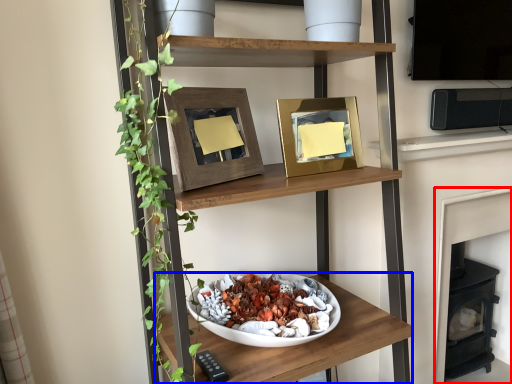
Question: Which point is further to the camera, fireplace (highlighted by a red box) or shelf (highlighted by a blue box)?

Choices:
 (A) fireplace
 (B) shelf

Answer: (A)